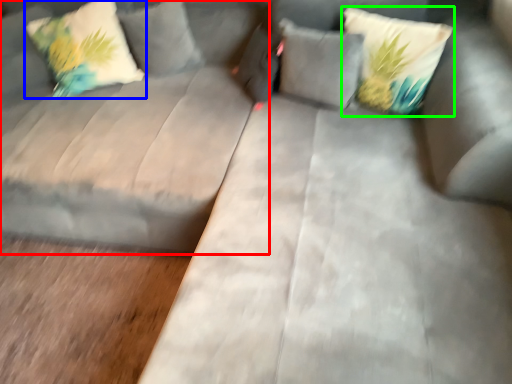
Question: Estimate the real-world distances between objects in this image. Which object is farther from couch (highlighted by a red box), pillow (highlighted by a blue box) or pillow (highlighted by a green box)?

Choices:
 (A) pillow
 (B) pillow

Answer: (B)